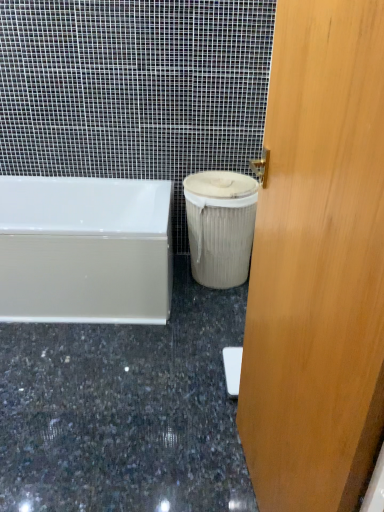
Question: Could you tell me if granite at lower center is facing wooden door at center?

Choices:
 (A) no
 (B) yes

Answer: (A)

Question: Does granite at lower center appear on the right side of wooden door at center?

Choices:
 (A) no
 (B) yes

Answer: (A)

Question: Can you confirm if granite at lower center is bigger than wooden door at center?

Choices:
 (A) yes
 (B) no

Answer: (B)

Question: Is granite at lower center oriented away from wooden door at center?

Choices:
 (A) yes
 (B) no

Answer: (B)

Question: Is granite at lower center outside of wooden door at center?

Choices:
 (A) no
 (B) yes

Answer: (B)

Question: Would you say granite at lower center is a long distance from wooden door at center?

Choices:
 (A) yes
 (B) no

Answer: (B)

Question: From the image's perspective, is beige fabric trash can at lower right under granite at lower center?

Choices:
 (A) no
 (B) yes

Answer: (A)

Question: Is the depth of beige fabric trash can at lower right less than that of granite at lower center?

Choices:
 (A) yes
 (B) no

Answer: (B)

Question: Considering the relative sizes of beige fabric trash can at lower right and granite at lower center in the image provided, is beige fabric trash can at lower right wider than granite at lower center?

Choices:
 (A) yes
 (B) no

Answer: (B)

Question: Can you confirm if beige fabric trash can at lower right is thinner than granite at lower center?

Choices:
 (A) yes
 (B) no

Answer: (A)

Question: Would you say granite at lower center is part of beige fabric trash can at lower right's contents?

Choices:
 (A) no
 (B) yes

Answer: (A)

Question: Is beige fabric trash can at lower right shorter than granite at lower center?

Choices:
 (A) no
 (B) yes

Answer: (A)

Question: Does granite at lower center come in front of white glossy bathtub at lower left?

Choices:
 (A) yes
 (B) no

Answer: (A)